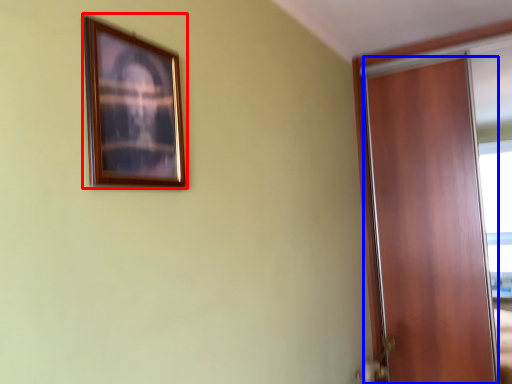
Question: Among these objects, which one is nearest to the camera, picture frame (highlighted by a red box) or door (highlighted by a blue box)?

Choices:
 (A) picture frame
 (B) door

Answer: (A)